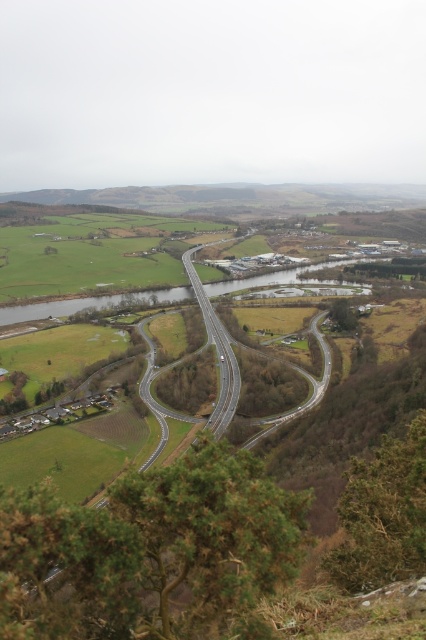
Question: Which object is closer to the camera taking this photo?

Choices:
 (A) smooth asphalt highway at center
 (B) green grassy river at center

Answer: (A)

Question: Is green grassy river at center positioned before smooth asphalt highway at center?

Choices:
 (A) no
 (B) yes

Answer: (A)

Question: Can you confirm if green grassy river at center is positioned above smooth asphalt highway at center?

Choices:
 (A) no
 (B) yes

Answer: (B)

Question: Is green grassy river at center to the right of smooth asphalt highway at center from the viewer's perspective?

Choices:
 (A) no
 (B) yes

Answer: (B)

Question: Among these points, which one is farthest from the camera?

Choices:
 (A) (278, 276)
 (B) (203, 310)

Answer: (A)